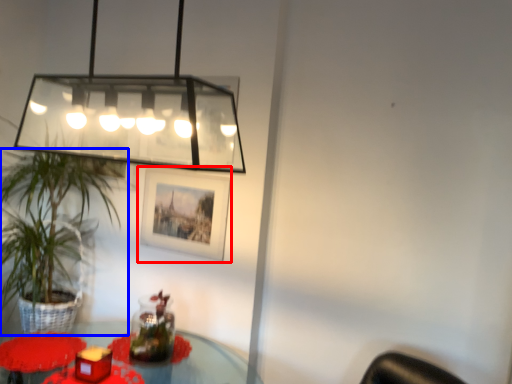
Question: Which of the following is the closest to the observer, picture frame (highlighted by a red box) or houseplant (highlighted by a blue box)?

Choices:
 (A) picture frame
 (B) houseplant

Answer: (B)